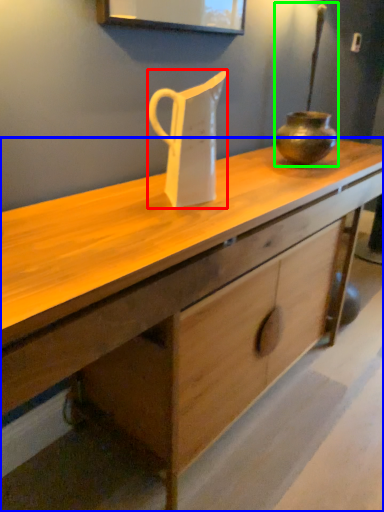
Question: Which object is positioned farthest from jug (highlighted by a red box)? Select from desk (highlighted by a blue box) and candle holder (highlighted by a green box).

Choices:
 (A) desk
 (B) candle holder

Answer: (B)